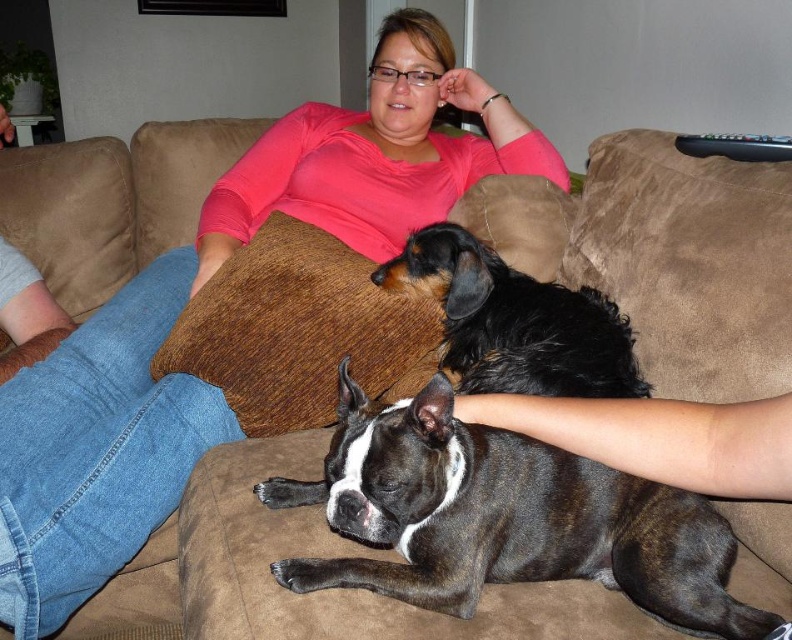
You are a dog trainer assessing the space between two dogs on the couch. The brindle fur dog at center and the black curly fur dog at center are lying next to each other. Which dog takes up more horizontal space on the couch?

The brindle fur dog at center has a greater width than the black curly fur dog at center, so it takes up more horizontal space on the couch.

You are a delivery robot that needs to place a small package between the brindle fur dog at center and the black curly fur dog at center on the couch. Can you fit the package between them if it requires 12 inches of space?

The brindle fur dog at center and black curly fur dog at center are 12.67 inches apart, so yes, the package requiring 12 inches of space can fit between them since there is enough space available.